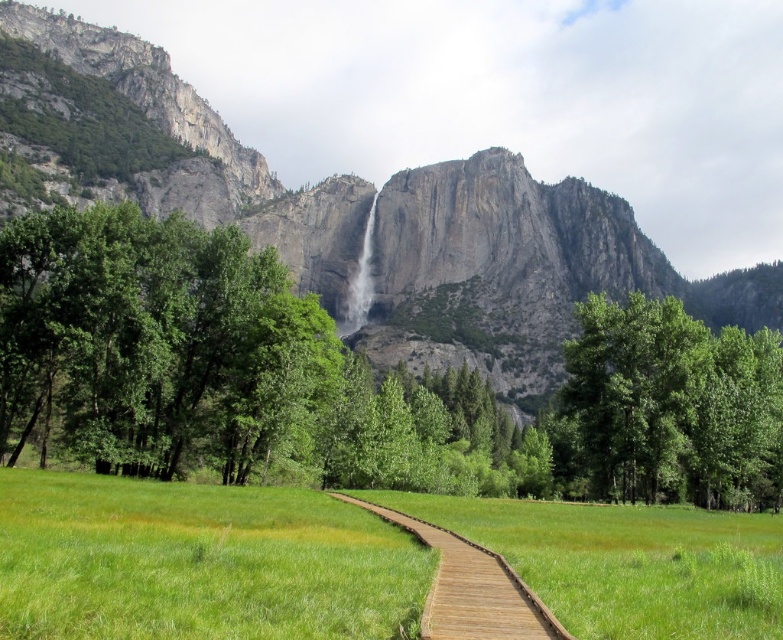
Question: Does green leafy tree at center-right come behind wooden boardwalk at center?

Choices:
 (A) no
 (B) yes

Answer: (B)

Question: Which object is farther from the camera taking this photo?

Choices:
 (A) green leafy tree at center
 (B) white textured waterfall at center
 (C) gray rock cliff at upper center
 (D) green leafy tree at center-right

Answer: (B)

Question: Is green grass at center wider than gray rock cliff at upper center?

Choices:
 (A) no
 (B) yes

Answer: (A)

Question: Is gray rock cliff at upper center closer to the viewer compared to green leafy tree at center-right?

Choices:
 (A) no
 (B) yes

Answer: (A)

Question: Estimate the real-world distances between objects in this image. Which object is farther from the green grass at center?

Choices:
 (A) wooden boardwalk at center
 (B) white textured waterfall at center

Answer: (B)

Question: Among these objects, which one is farthest from the camera?

Choices:
 (A) green grass at center
 (B) white textured waterfall at center
 (C) wooden boardwalk at center

Answer: (B)